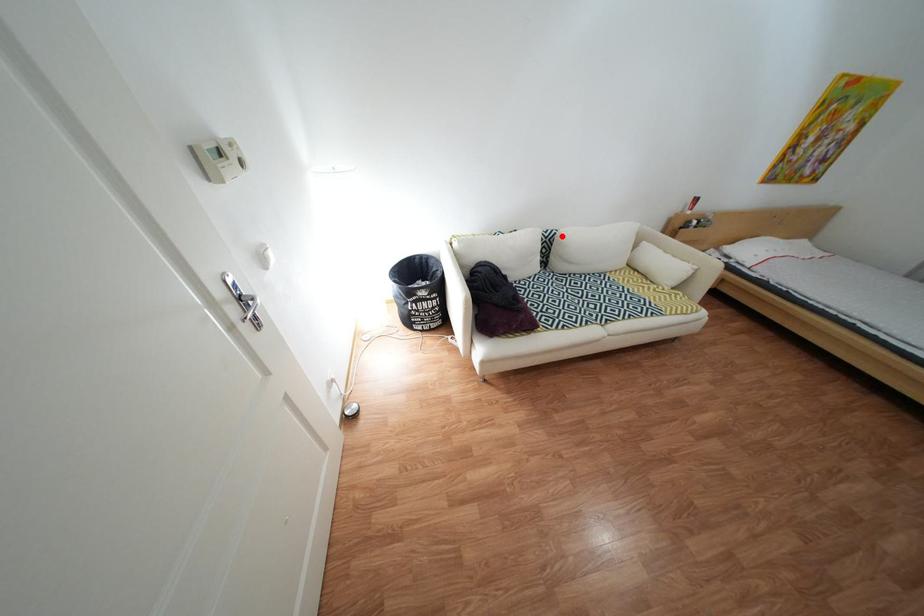
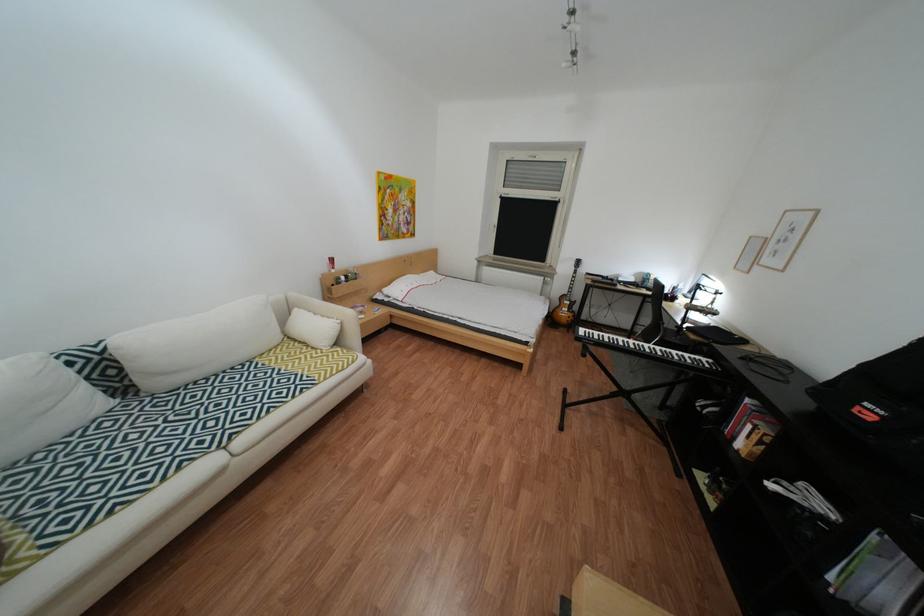
Question: I am providing you with two images of the same scene from different viewpoints. Image1 has a red point marked. In image2, the corresponding 3D location appears at what relative position? Reply with the corresponding letter.

Choices:
 (A) Closer
 (B) Farther

Answer: (B)